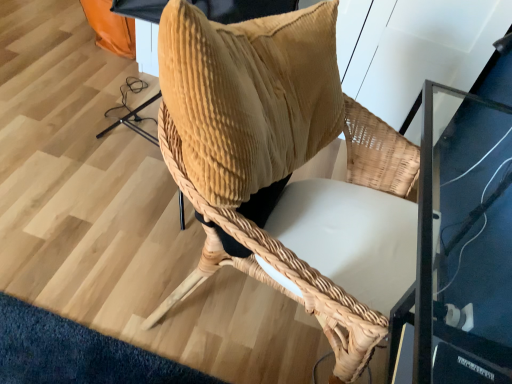
Question: Considering the relative positions of woven wood chair at center and corduroy pillow at center in the image provided, is woven wood chair at center to the left or to the right of corduroy pillow at center?

Choices:
 (A) right
 (B) left

Answer: (A)

Question: From the image's perspective, is woven wood chair at center located above or below corduroy pillow at center?

Choices:
 (A) below
 (B) above

Answer: (A)

Question: Is woven wood chair at center inside or outside of corduroy pillow at center?

Choices:
 (A) inside
 (B) outside

Answer: (B)

Question: In terms of size, does corduroy pillow at center appear bigger or smaller than woven wood chair at center?

Choices:
 (A) small
 (B) big

Answer: (A)

Question: From a real-world perspective, relative to woven wood chair at center, is corduroy pillow at center vertically above or below?

Choices:
 (A) above
 (B) below

Answer: (A)

Question: Do you think corduroy pillow at center is within woven wood chair at center, or outside of it?

Choices:
 (A) outside
 (B) inside

Answer: (B)

Question: Does point (263, 137) appear closer or farther from the camera than point (378, 180)?

Choices:
 (A) farther
 (B) closer

Answer: (B)